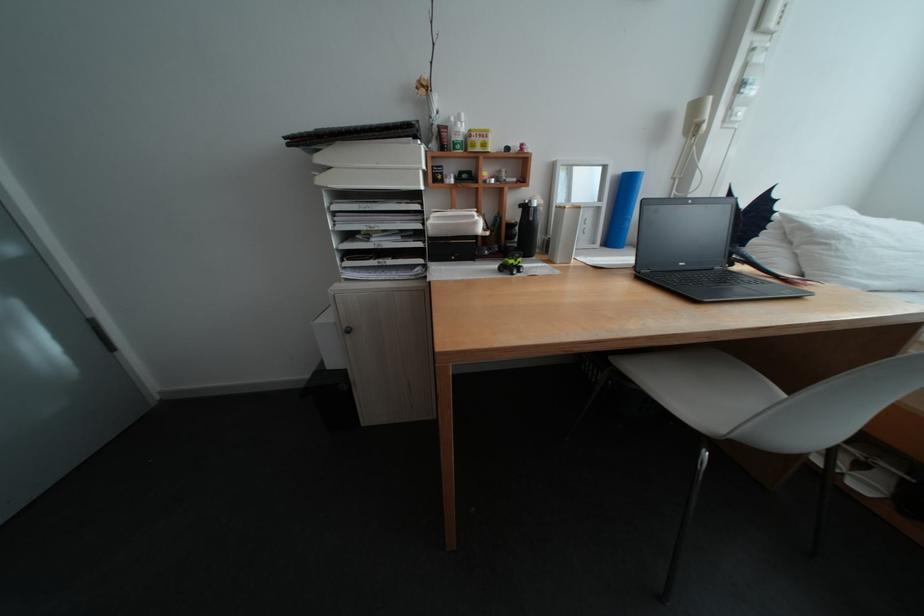
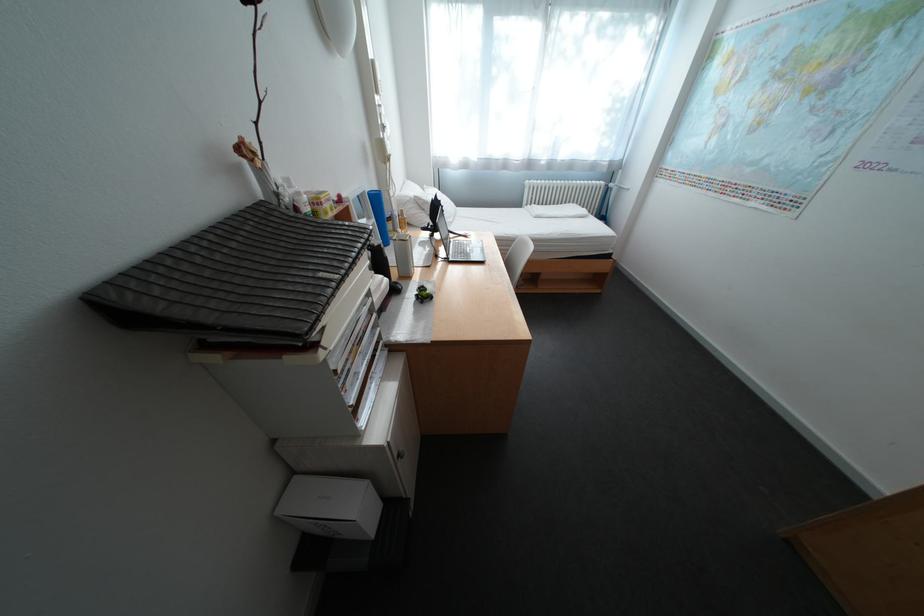
Find the pixel in the second image that matches [470,225] in the first image.

(395, 292)